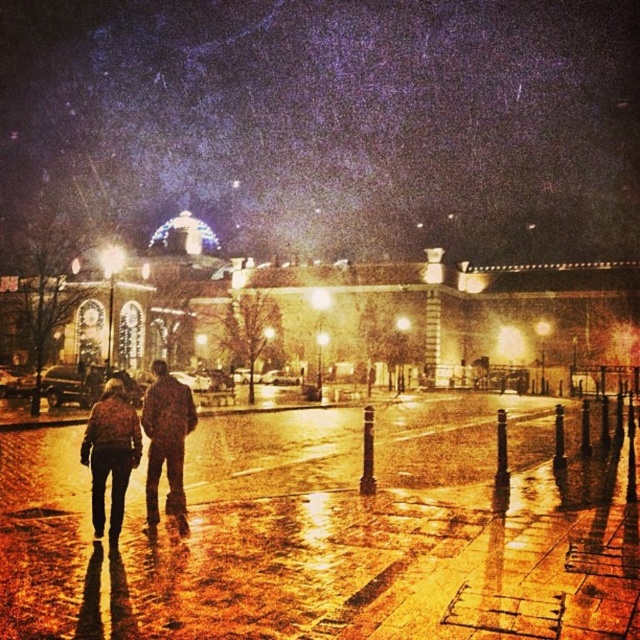
Question: Considering the relative positions of flannel shirt at center and dark brown leather jacket at center in the image provided, where is flannel shirt at center located with respect to dark brown leather jacket at center?

Choices:
 (A) left
 (B) right

Answer: (A)

Question: Which point is closer to the camera taking this photo?

Choices:
 (A) (108, 406)
 (B) (180, 424)
 (C) (177, 432)

Answer: (A)

Question: Which point is closer to the camera taking this photo?

Choices:
 (A) (128, 435)
 (B) (100, 500)

Answer: (B)

Question: Does flannel shirt at center appear on the left side of brown leather jacket at lower left?

Choices:
 (A) yes
 (B) no

Answer: (B)

Question: Which point is farther from the camera taking this photo?

Choices:
 (A) (189, 410)
 (B) (100, 508)
 (C) (152, 460)

Answer: (A)

Question: Is flannel shirt at center to the left of dark brown leather jacket at center from the viewer's perspective?

Choices:
 (A) no
 (B) yes

Answer: (B)